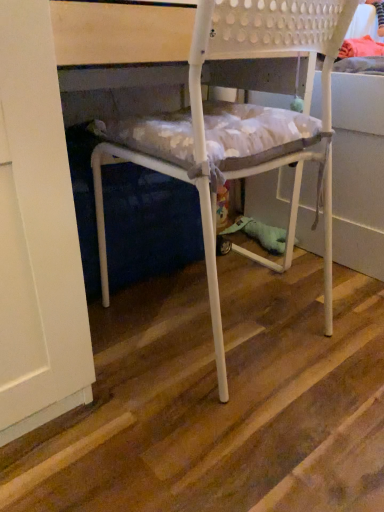
The image size is (384, 512). I want to click on vacant space underneath white matte plastic chair at center (from a real-world perspective), so click(241, 332).